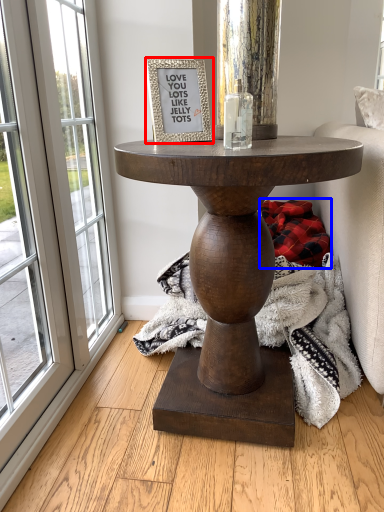
Question: Which of the following is the farthest to the observer, picture frame (highlighted by a red box) or blanket (highlighted by a blue box)?

Choices:
 (A) picture frame
 (B) blanket

Answer: (B)